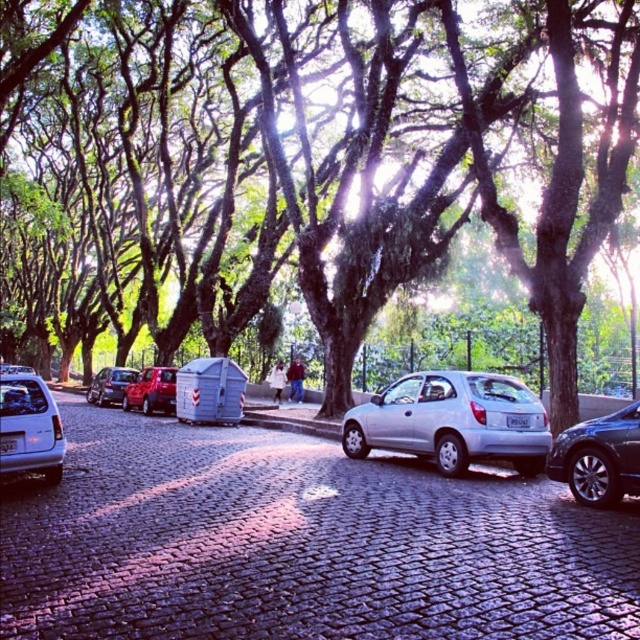
Question: Which point is closer to the camera?

Choices:
 (A) green leafy tree at center
 (B) shiny red car at center
 (C) shiny metallic car at left

Answer: (A)

Question: Can you confirm if silver metallic hatchback at left is positioned below shiny red car at center?

Choices:
 (A) yes
 (B) no

Answer: (B)

Question: Which object is closer to the camera taking this photo?

Choices:
 (A) shiny red car at center
 (B) silver metallic car at center
 (C) silver metallic hatchback at center
 (D) green leafy tree at center

Answer: (B)

Question: Is silver metallic hatchback at center below shiny black sedan at right?

Choices:
 (A) no
 (B) yes

Answer: (B)

Question: Can you confirm if green leafy tree at center is positioned to the right of shiny red car at center?

Choices:
 (A) no
 (B) yes

Answer: (A)

Question: Which point is closer to the camera?

Choices:
 (A) silver metallic hatchback at center
 (B) shiny red car at center

Answer: (A)